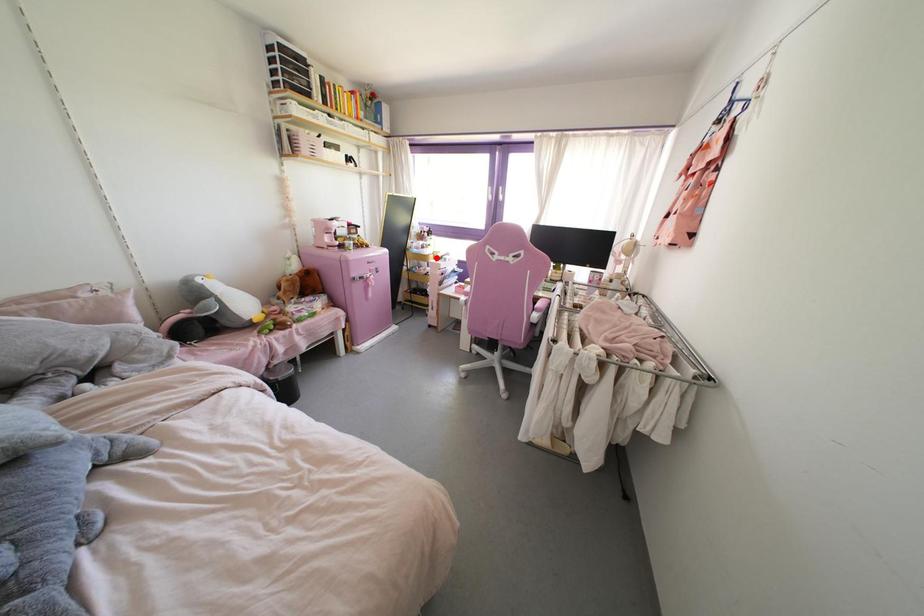
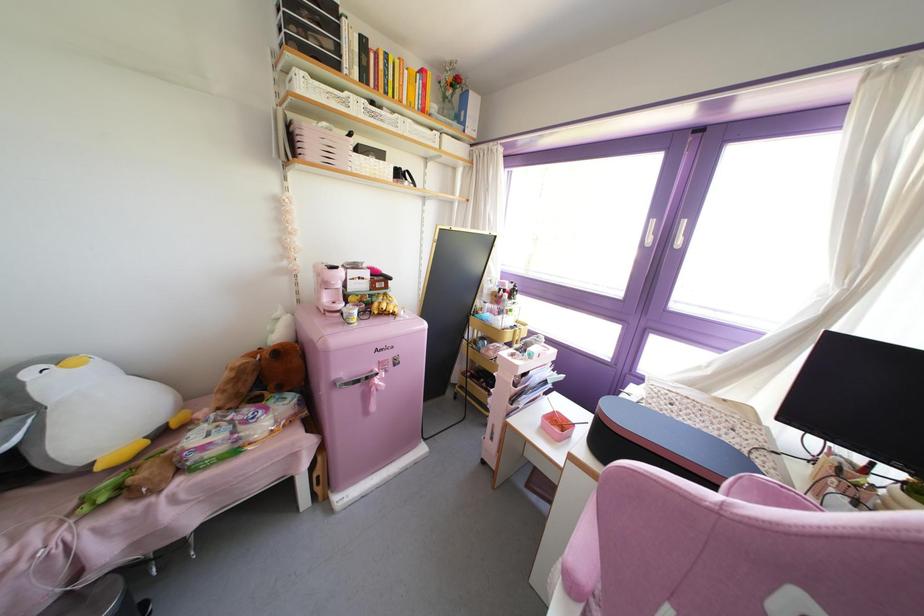
Question: I am providing you with two images of the same scene from different viewpoints. A red point is shown in image1. For the corresponding object point in image2, is it positioned nearer or farther from the camera?

Choices:
 (A) Nearer
 (B) Farther

Answer: (B)